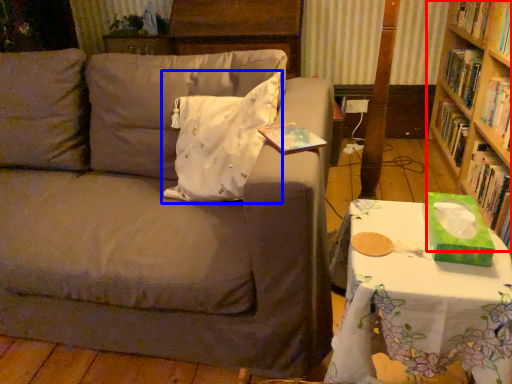
Question: Which of the following is the closest to the observer, bookcase (highlighted by a red box) or pillow (highlighted by a blue box)?

Choices:
 (A) bookcase
 (B) pillow

Answer: (B)